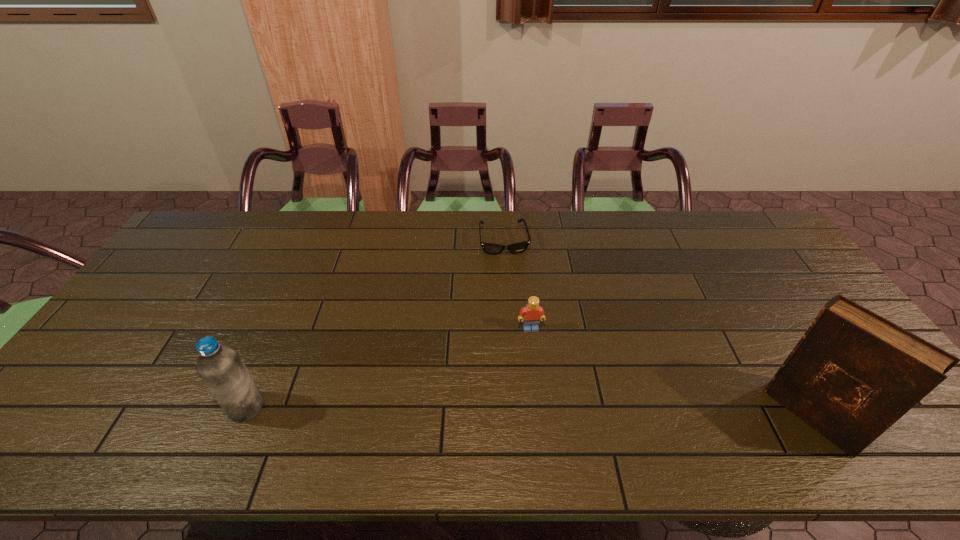
The width and height of the screenshot is (960, 540). Find the location of `object located at the near right corner`. object located at the near right corner is located at coordinates (853, 374).

Identify the location of vacant space at the far edge. (396, 249).

In the image, there is a desktop. Identify the location of free region at the near edge. This screenshot has width=960, height=540. (583, 413).

In order to click on vacant space at the left edge in this screenshot , I will do `click(194, 271)`.

Where is `vacant space at the right edge of the desktop`? vacant space at the right edge of the desktop is located at coordinates (785, 254).

At what (x,y) coordinates should I click in order to perform the action: click on blank space at the near left corner of the desktop. Please return your answer as a coordinate pair (x, y). The width and height of the screenshot is (960, 540). Looking at the image, I should click on (124, 399).

You are a GUI agent. You are given a task and a screenshot of the screen. Output one action in this format:
    pyautogui.click(x=<x>, y=<y>)
    Task: Click on the vacant area that lies between the Lego and the farthest object
    
    Given the screenshot: What is the action you would take?
    pyautogui.click(x=517, y=285)

Find the location of a particular element. free spot between the second farthest object and the water bottle is located at coordinates (389, 368).

The height and width of the screenshot is (540, 960). In order to click on vacant space that is in between the tallest object and the water bottle in this screenshot , I will do `click(529, 411)`.

Where is `unoccupied position between the water bottle and the third tallest object`? The width and height of the screenshot is (960, 540). unoccupied position between the water bottle and the third tallest object is located at coordinates (389, 368).